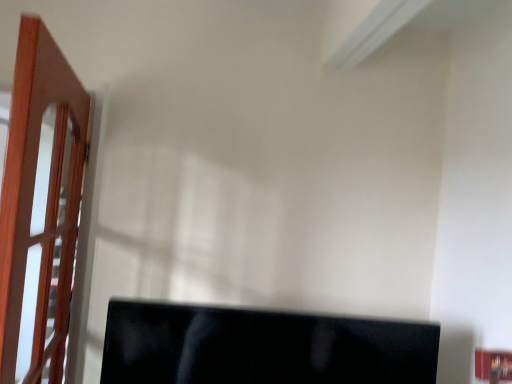
Question: Is light brown wooden door at left inside the boundaries of black glossy monitor at lower center, or outside?

Choices:
 (A) outside
 (B) inside

Answer: (A)

Question: Considering the positions of point (53, 132) and point (316, 367), is point (53, 132) closer or farther from the camera than point (316, 367)?

Choices:
 (A) farther
 (B) closer

Answer: (A)

Question: From the image's perspective, is light brown wooden door at left positioned above or below black glossy monitor at lower center?

Choices:
 (A) above
 (B) below

Answer: (A)

Question: Is black glossy monitor at lower center situated inside light brown wooden door at left or outside?

Choices:
 (A) outside
 (B) inside

Answer: (A)

Question: Is black glossy monitor at lower center in front of or behind light brown wooden door at left in the image?

Choices:
 (A) behind
 (B) front

Answer: (A)

Question: Does point 360,380 appear closer or farther from the camera than point 11,281?

Choices:
 (A) closer
 (B) farther

Answer: (B)

Question: In terms of width, does black glossy monitor at lower center look wider or thinner when compared to light brown wooden door at left?

Choices:
 (A) wide
 (B) thin

Answer: (A)